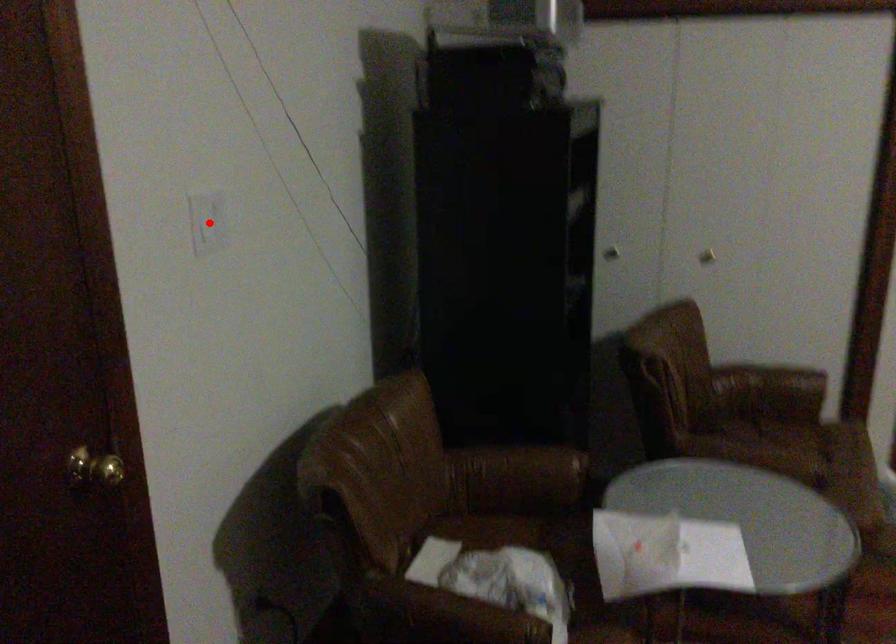
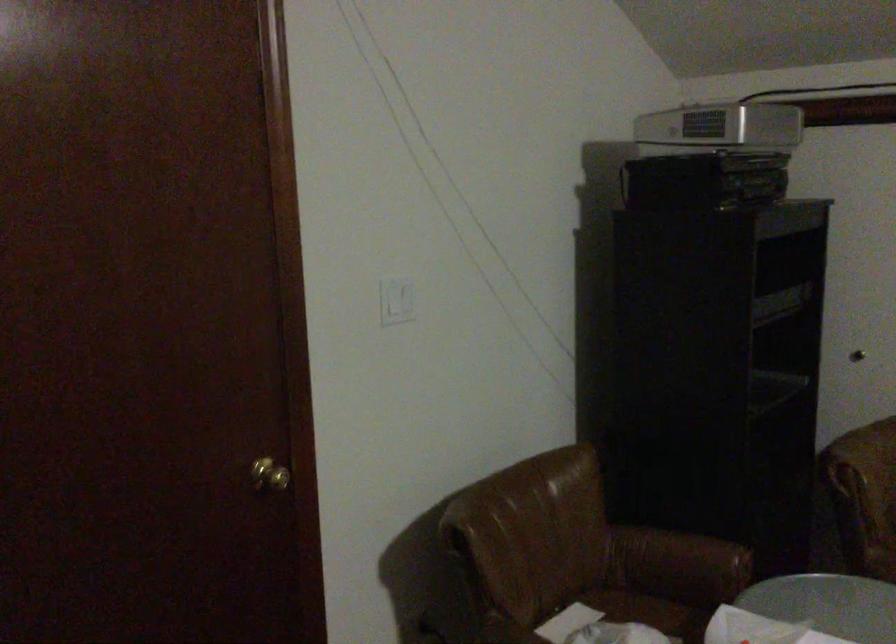
Where in the second image is the point corresponding to the highlighted location from the first image?

(397, 301)